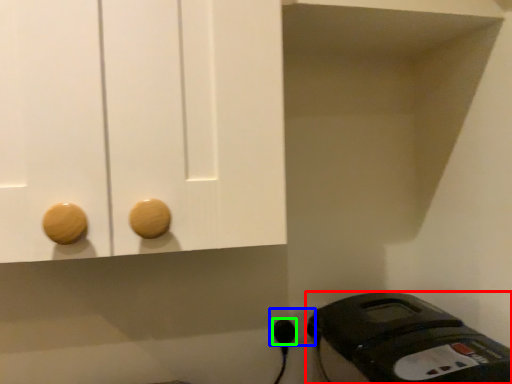
Question: Estimate the real-world distances between objects in this image. Which object is farther from home appliance (highlighted by a red box), electric outlet (highlighted by a blue box) or plug (highlighted by a green box)?

Choices:
 (A) electric outlet
 (B) plug

Answer: (B)